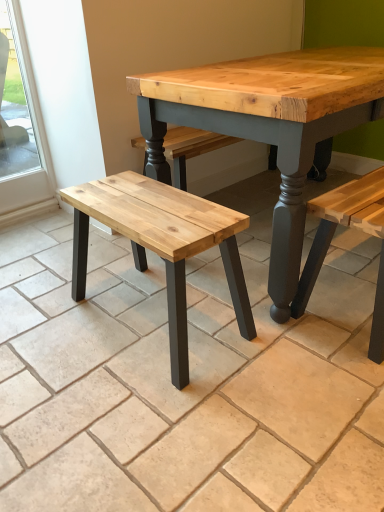
The height and width of the screenshot is (512, 384). What are the coordinates of `vacant space in front of natural wood bench at left` in the screenshot? It's located at (157, 419).